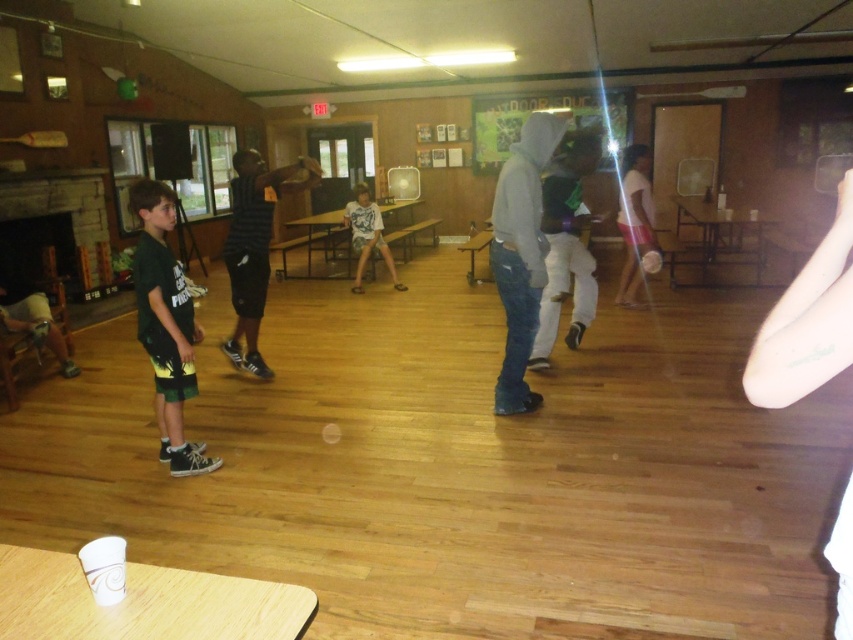
You are a photographer standing at the entrance of the room. You want to take a photo that includes both the black mesh shirt at center and the white matte shirt at center. Given that your camera has a maximum focus range of 3 meters, will you be able to capture both subjects in focus?

The black mesh shirt at center and white matte shirt at center are 3.15 meters apart from each other. Since the distance between them exceeds the camera maximum focus range of 3 meters, you will not be able to capture both subjects in focus.

You are standing in the center of the room and see both the gray hoodie at center and the black mesh shirt at center. Which one is positioned to the right side from your perspective?

The gray hoodie at center is positioned to the right of the black mesh shirt at center, so from your perspective in the center of the room, the gray hoodie at center is on the right side.

You are standing at the entrance of the community center and see two points marked in the room. The first point is at coordinate point[251,192] and the second is at point[619,205]. Which point is closer to you?

Point[251,192] is in front of point[619,205], so it is closer to you.